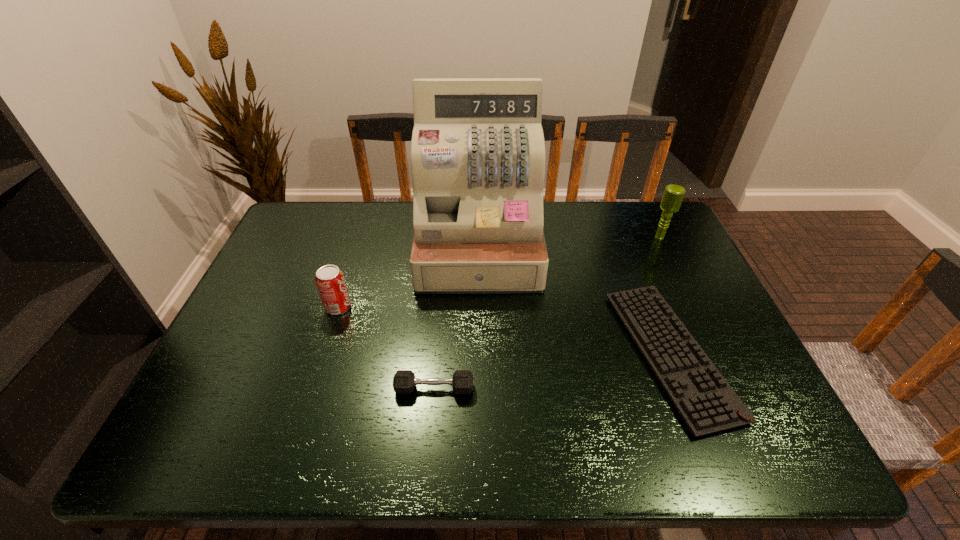
At what (x,y) coordinates should I click in order to perform the action: click on vacant space located 0.370m on the back of the computer keyboard. Please return your answer as a coordinate pair (x, y). This screenshot has width=960, height=540. Looking at the image, I should click on (615, 214).

At what (x,y) coordinates should I click in order to perform the action: click on cash register positioned at the far edge. Please return your answer as a coordinate pair (x, y). Image resolution: width=960 pixels, height=540 pixels. Looking at the image, I should click on (478, 156).

At what (x,y) coordinates should I click in order to perform the action: click on microphone positioned at the far edge. Please return your answer as a coordinate pair (x, y). The width and height of the screenshot is (960, 540). Looking at the image, I should click on (673, 195).

Image resolution: width=960 pixels, height=540 pixels. Find the location of `object located in the near edge section of the desktop`. object located in the near edge section of the desktop is located at coordinates (706, 402).

You are a GUI agent. You are given a task and a screenshot of the screen. Output one action in this format:
    pyautogui.click(x=<x>, y=<y>)
    Task: Click on the microphone at the right edge
    
    Given the screenshot: What is the action you would take?
    pyautogui.click(x=673, y=195)

Locate an element on the screen. The image size is (960, 540). computer keyboard that is at the right edge is located at coordinates (706, 402).

Where is `object positioned at the far right corner`? This screenshot has width=960, height=540. object positioned at the far right corner is located at coordinates (673, 195).

The image size is (960, 540). I want to click on object situated at the near right corner, so click(x=706, y=402).

Find the location of a particular element. The width and height of the screenshot is (960, 540). vacant space at the far edge of the desktop is located at coordinates (564, 204).

Locate an element on the screen. The image size is (960, 540). vacant space at the near edge of the desktop is located at coordinates (519, 438).